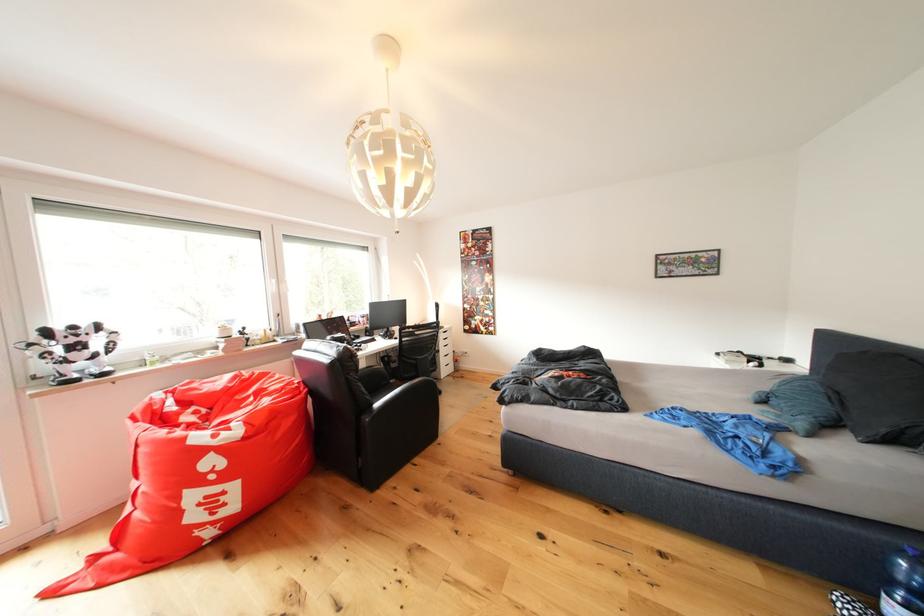
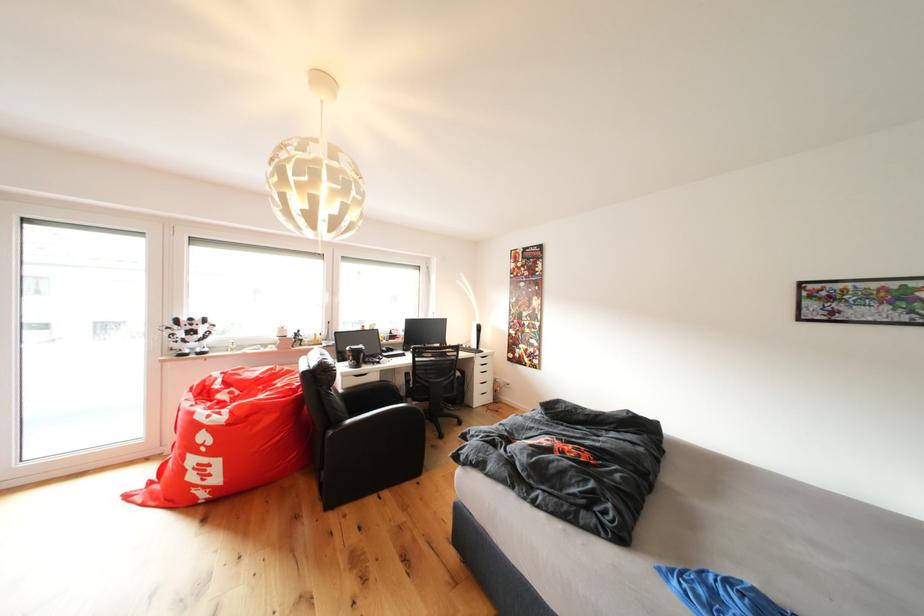
The point at (82, 333) is marked in the first image. Where is the corresponding point in the second image?

(200, 323)